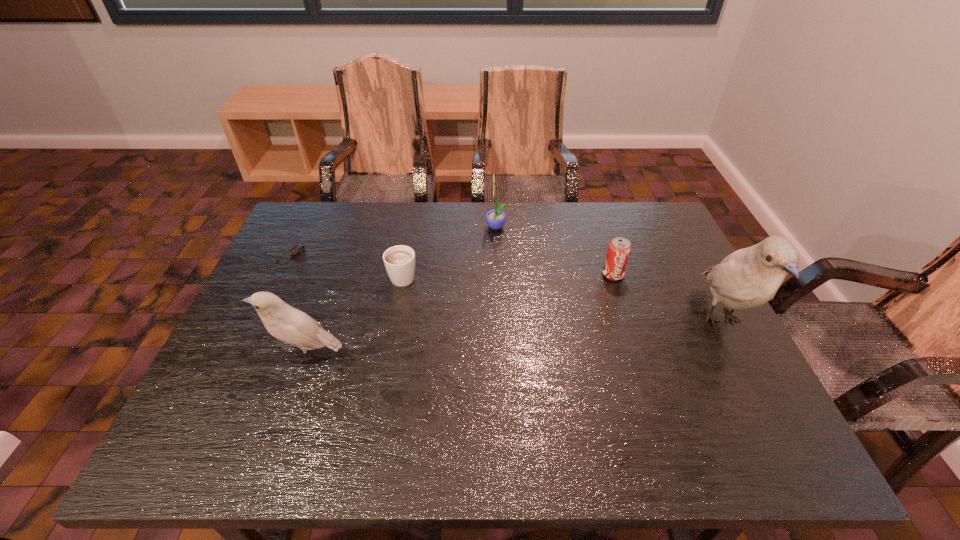
The width and height of the screenshot is (960, 540). Find the location of `the second shortest object`. the second shortest object is located at coordinates 399,261.

You are a GUI agent. You are given a task and a screenshot of the screen. Output one action in this format:
    pyautogui.click(x=<x>, y=<y>)
    Task: Click on the third object from left to right
    Image resolution: width=960 pixels, height=540 pixels.
    Given the screenshot: What is the action you would take?
    pyautogui.click(x=399, y=261)

Locate an element on the screen. vacant space positioned 0.090m at the beak of the second object from left to right is located at coordinates (230, 354).

Locate an element on the screen. Image resolution: width=960 pixels, height=540 pixels. vacant space located 0.070m at the beak of the second object from left to right is located at coordinates (238, 354).

This screenshot has width=960, height=540. I want to click on vacant area situated at the beak of the right bird, so click(x=764, y=402).

Find the location of a particular element. The width and height of the screenshot is (960, 540). vacant space located 0.090m on the back of the mouse is located at coordinates (303, 228).

Identify the location of free space located 0.350m on the left of the soda can. (478, 274).

Find the location of a particular element. This screenshot has width=960, height=540. free location located on the front-facing side of the sunflower is located at coordinates (378, 228).

The image size is (960, 540). In order to click on vacant position located 0.340m on the front-facing side of the sunflower in this screenshot , I will do `click(378, 228)`.

This screenshot has width=960, height=540. I want to click on free region located on the front-facing side of the sunflower, so click(x=366, y=228).